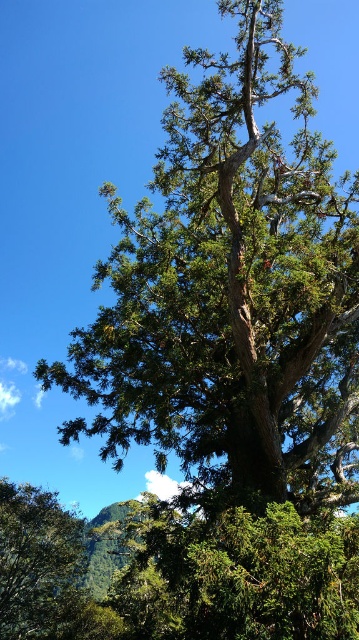
You are a hiker standing at the base of the green rough bark tree at center and want to see the green textured tree at lower left clearly. Can you see it without any obstruction from the tree you are at?

The green rough bark tree at center is in front of the green textured tree at lower left, so it might block your view of the green textured tree at lower left.